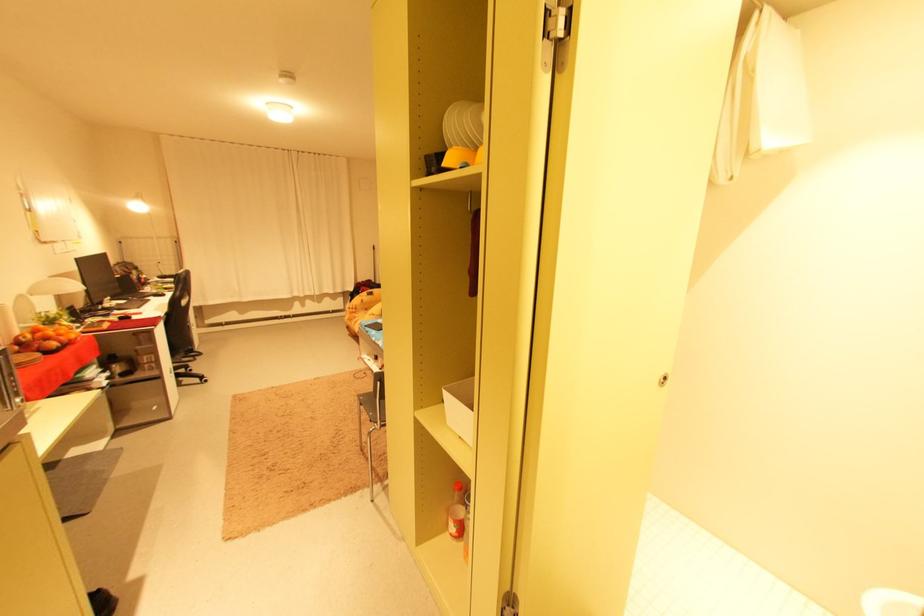
Identify the location of yellow bowl. (457, 158).